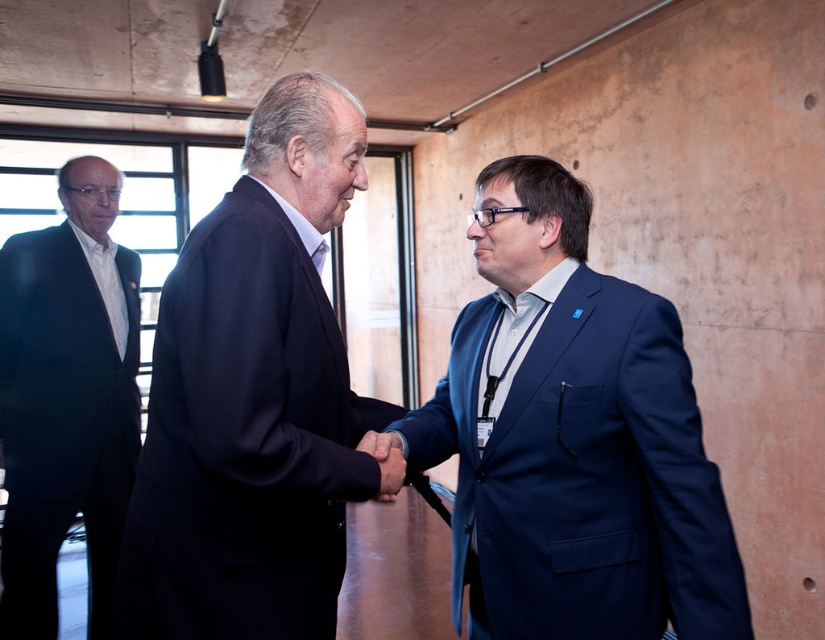
You are standing at the origin point in the image. There is a dark blue suit at center represented by point (x=255, y=397). Can you tell me the direction of the dark blue suit at center from your current position?

The dark blue suit at center is located at point (x=255, y=397), which is to the northeast direction from the origin point.

You are standing in the room and want to place a small decorative item exactly halfway between the two points, point (211, 364) and point (99, 560). Which point is closer to the decorative item once placed?

The point closer to the decorative item will be point (211, 364) because it is closer to the viewer than point (99, 560).

You are a photographer at a professional event. You need to capture a photo where both the blue fabric suit at center and the black suit at left are visible. Considering their heights, which suit will appear closer to the bottom of the frame?

The blue fabric suit at center is shorter than the black suit at left, so it will appear closer to the bottom of the frame since shorter objects occupy lower positions in the image.